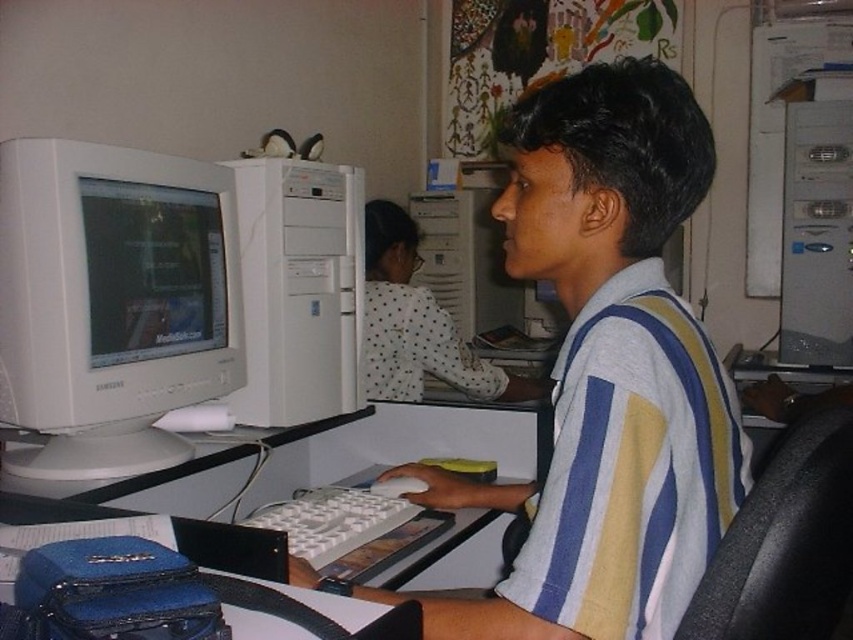
Can you confirm if white plastic desktop computer at center is wider than matte white monitor at left?

Indeed, white plastic desktop computer at center has a greater width compared to matte white monitor at left.

This screenshot has width=853, height=640. What do you see at coordinates (299, 289) in the screenshot?
I see `white plastic desktop computer at center` at bounding box center [299, 289].

You are a GUI agent. You are given a task and a screenshot of the screen. Output one action in this format:
    pyautogui.click(x=<x>, y=<y>)
    Task: Click on the white plastic desktop computer at center
    
    Given the screenshot: What is the action you would take?
    pyautogui.click(x=299, y=289)

Does white matte shirt at center have a lesser height compared to white plastic desktop computer at center?

No.

Between white matte shirt at center and white plastic desktop computer at center, which one is positioned higher?

white plastic desktop computer at center

Locate an element on the screen. This screenshot has width=853, height=640. white matte shirt at center is located at coordinates (606, 371).

Is white glossy computer monitor at left shorter than white plastic keyboard at center?

In fact, white glossy computer monitor at left may be taller than white plastic keyboard at center.

Measure the distance between white glossy computer monitor at left and camera.

white glossy computer monitor at left is 1.06 meters from camera.

Does point (152, 244) lie in front of point (294, 552)?

No.

The image size is (853, 640). In order to click on white glossy computer monitor at left in this screenshot , I will do `click(112, 301)`.